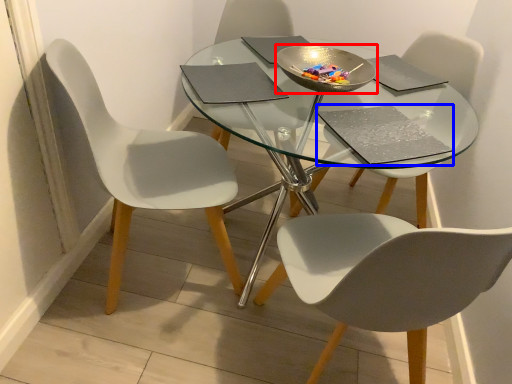
Question: Which of the following is the farthest to the observer, bowl (highlighted by a red box) or pad (highlighted by a blue box)?

Choices:
 (A) bowl
 (B) pad

Answer: (A)